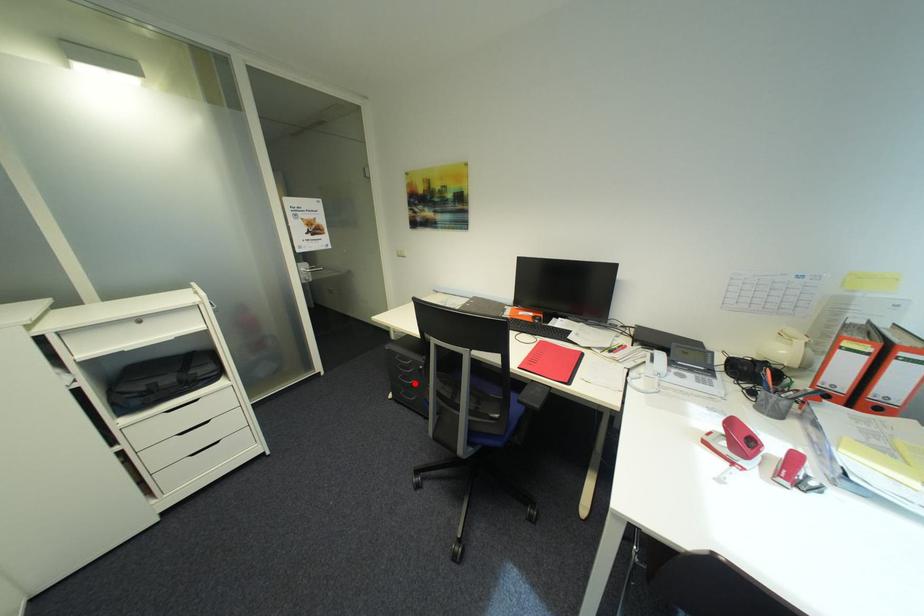
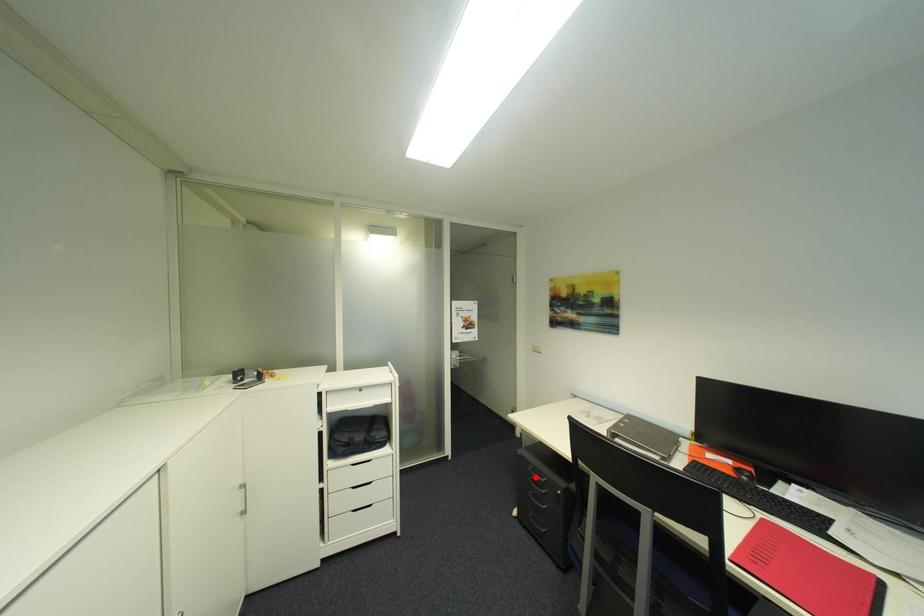
I am providing you with two images of the same scene from different viewpoints. A red point is marked on the first image and another point is marked on the second image. Is the red point in image1 aligned with the point shown in image2?

No